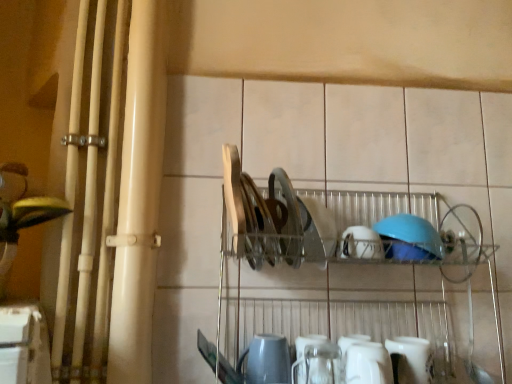
Question: Can you confirm if metallic silver dish rack at center is thinner than white glossy mug at lower center, the first tableware in the bottom-to-top sequence?

Choices:
 (A) yes
 (B) no

Answer: (B)

Question: Does metallic silver dish rack at center have a greater height compared to white glossy mug at lower center, which is the fourth tableware from left to right?

Choices:
 (A) yes
 (B) no

Answer: (A)

Question: Can you confirm if metallic silver dish rack at center is wider than white glossy mug at lower center, which is the fourth tableware from left to right?

Choices:
 (A) no
 (B) yes

Answer: (B)

Question: From the image's perspective, is metallic silver dish rack at center beneath white glossy mug at lower center, the first tableware in the bottom-to-top sequence?

Choices:
 (A) yes
 (B) no

Answer: (B)

Question: Is metallic silver dish rack at center smaller than white glossy mug at lower center, the 1th tableware viewed from the right?

Choices:
 (A) yes
 (B) no

Answer: (B)

Question: Is metallic silver dish rack at center located outside white glossy mug at lower center, which is the fourth tableware from top to bottom?

Choices:
 (A) yes
 (B) no

Answer: (A)

Question: Is white glossy mug at lower center, the first tableware in the bottom-to-top sequence, next to white glossy mug at lower center, which is counted as the third tableware, starting from the bottom, and touching it?

Choices:
 (A) no
 (B) yes

Answer: (B)

Question: Considering the relative positions of white glossy mug at lower center, which is the fourth tableware from top to bottom, and white glossy mug at lower center, which is counted as the third tableware, starting from the bottom, in the image provided, is white glossy mug at lower center, which is the fourth tableware from top to bottom, to the right of white glossy mug at lower center, which is counted as the third tableware, starting from the bottom, from the viewer's perspective?

Choices:
 (A) no
 (B) yes

Answer: (B)

Question: Is white glossy mug at lower center, the 1th tableware viewed from the right, wider than white glossy mug at lower center, which is counted as the third tableware, starting from the bottom?

Choices:
 (A) no
 (B) yes

Answer: (A)

Question: Is white glossy mug at lower center, which is counted as the third tableware, starting from the bottom, a part of white glossy mug at lower center, which is the fourth tableware from left to right?

Choices:
 (A) yes
 (B) no

Answer: (B)

Question: Does white glossy mug at lower center, the first tableware in the bottom-to-top sequence, come behind white glossy mug at lower center, the 3th tableware from the right?

Choices:
 (A) no
 (B) yes

Answer: (B)

Question: Does white glossy mug at lower center, the first tableware in the bottom-to-top sequence, have a larger size compared to white glossy mug at lower center, which is the second tableware in left-to-right order?

Choices:
 (A) no
 (B) yes

Answer: (A)

Question: Is white matte bowl at center, acting as the 4th tableware starting from the bottom, in front of metallic silver dish rack at center?

Choices:
 (A) yes
 (B) no

Answer: (B)